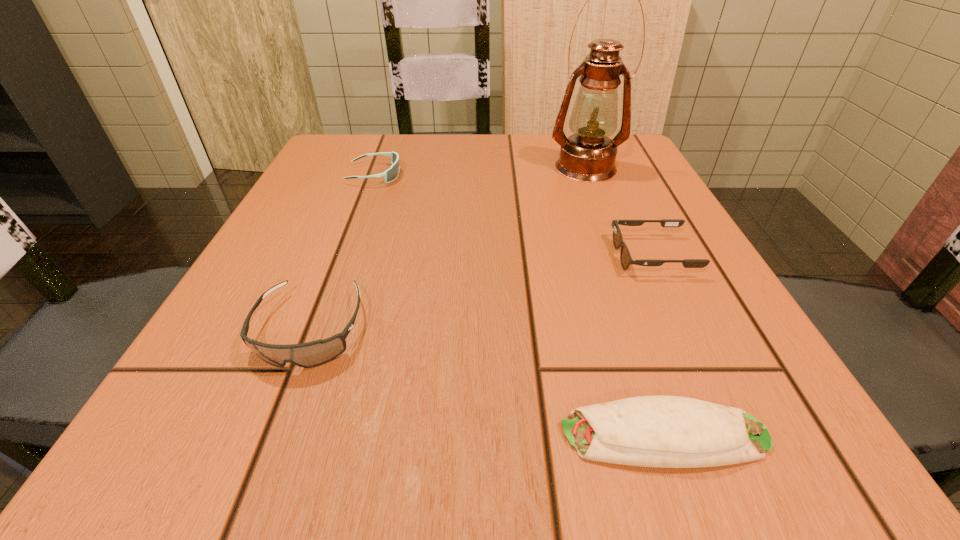
What are the coordinates of `the tallest object` in the screenshot? It's located at (588, 155).

Where is `the nearer goggles`? the nearer goggles is located at coordinates (311, 354).

The width and height of the screenshot is (960, 540). I want to click on the taller goggles, so click(x=311, y=354).

At what (x,y) coordinates should I click in order to perform the action: click on the shorter goggles. Please return your answer as a coordinate pair (x, y). Image resolution: width=960 pixels, height=540 pixels. Looking at the image, I should click on (391, 174).

Where is `the third nearest object`? the third nearest object is located at coordinates (625, 258).

Where is `the nearest object`? the nearest object is located at coordinates (650, 431).

Identify the location of vacant space located on the left of the oil lamp. (457, 167).

Where is `blank space located 0.080m on the lenses of the taller goggles`? blank space located 0.080m on the lenses of the taller goggles is located at coordinates (270, 434).

Where is `vacant space located 0.390m on the front-facing side of the shorter goggles`? The width and height of the screenshot is (960, 540). vacant space located 0.390m on the front-facing side of the shorter goggles is located at coordinates (585, 175).

The height and width of the screenshot is (540, 960). I want to click on free spot located on the temples of the third farthest object, so click(433, 255).